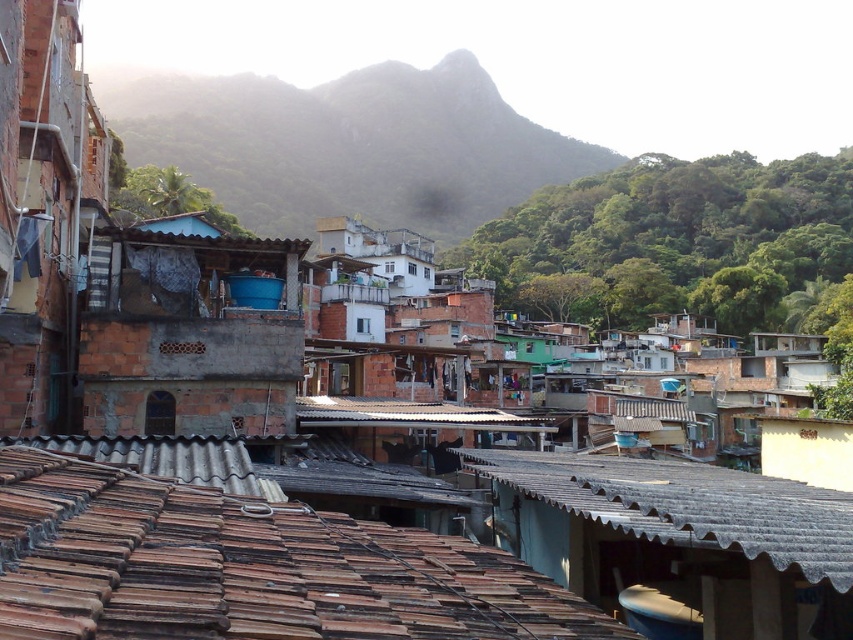
You are a drone operator flying over the urban area. You need to deliver a package to the brown tile roof at lower center without hitting the green leafy hillside at upper center. Can you safely navigate between them?

The brown tile roof at lower center is in front of the green leafy hillside at upper center, so the drone can safely navigate between them as the roof is closer to the drone than the hillside.

You are a delivery person trying to navigate through the rooftops of this urban area. You need to move from the brown tile roof at lower center to the rusty corrugated metal roof at center. According to the image, which direction should you move to reach your destination?

The brown tile roof at lower center is to the left of the rusty corrugated metal roof at center. To reach the rusty corrugated metal roof at center, you should move to the right from the brown tile roof at lower center.

You are a drone operator tasked with capturing aerial footage of the urban area. You notice the brown tile roof at lower center and the green leafy hillside at upper center in your camera view. Which of these two features takes up more area in your current frame?

The green leafy hillside at upper center takes up more area in the current frame than the brown tile roof at lower center because the brown tile roof at lower center occupies less space than green leafy hillside at upper center.